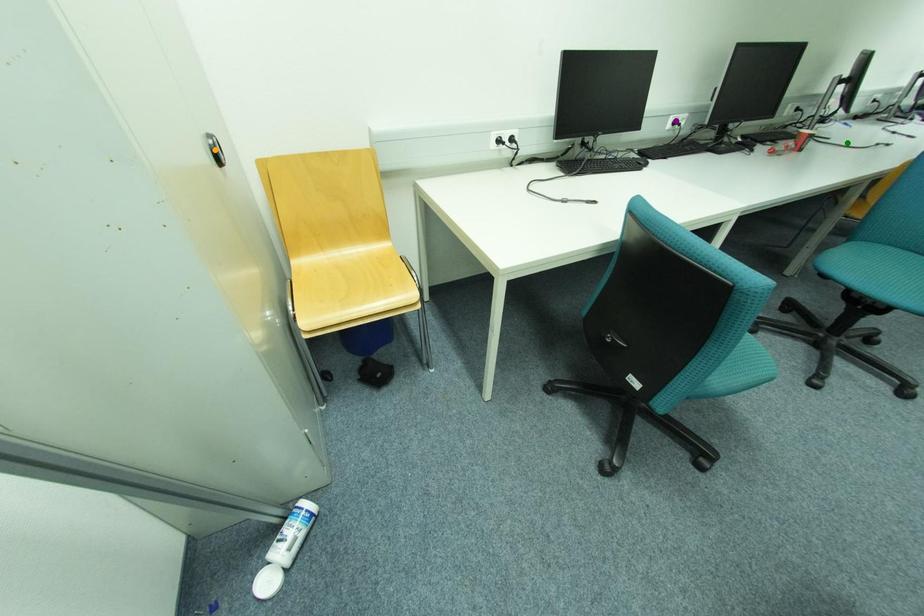
Order these from nearest to farthest:
purple point, orange point, green point

orange point < purple point < green point